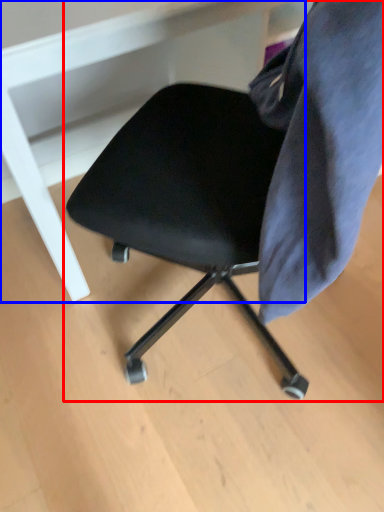
Question: Which object is closer to the camera taking this photo, chair (highlighted by a red box) or vanity (highlighted by a blue box)?

Choices:
 (A) chair
 (B) vanity

Answer: (A)